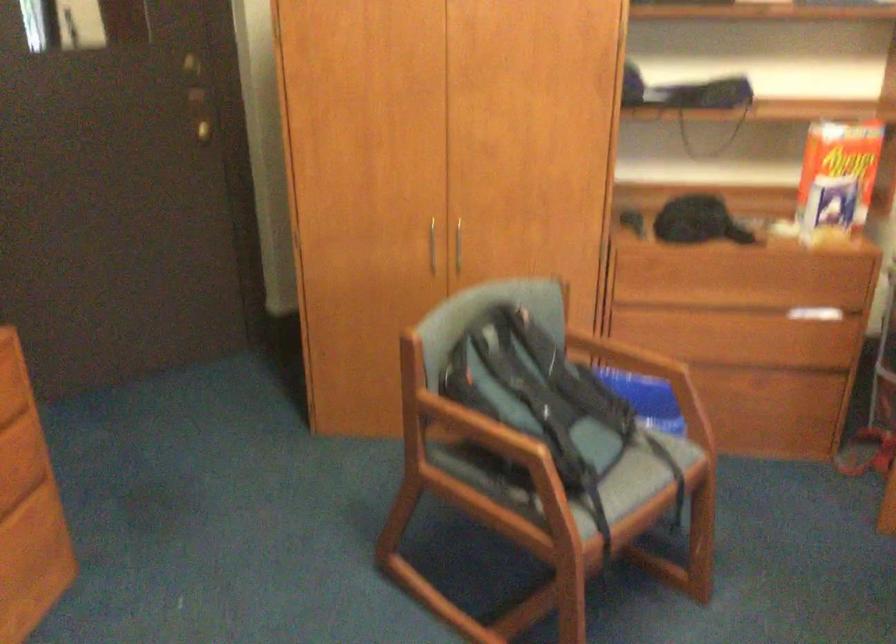
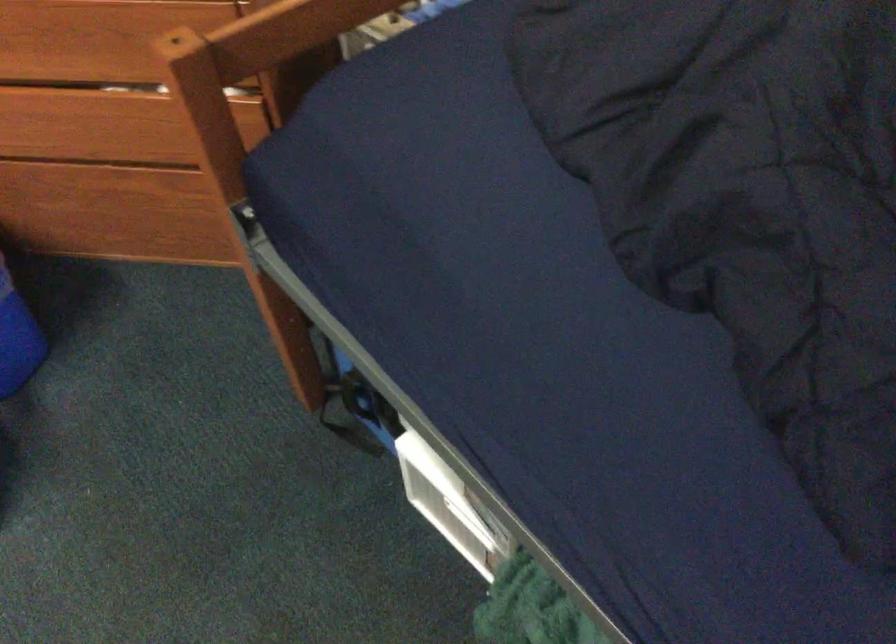
In a continuous first-person perspective shot, in which direction is the camera moving?

The cameraman moved toward right, forward.